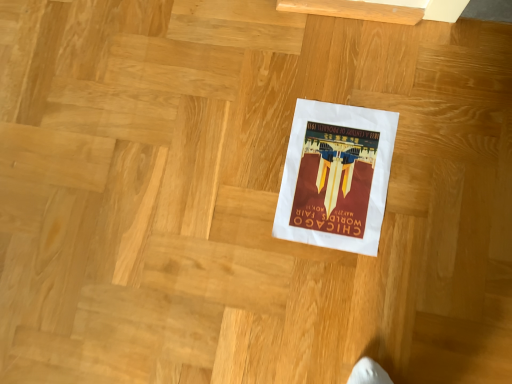
Question: Choose the correct answer: Is white paper at center inside white paper poster at center or outside it?

Choices:
 (A) inside
 (B) outside

Answer: (B)

Question: Based on their sizes in the image, would you say white paper at center is bigger or smaller than white paper poster at center?

Choices:
 (A) small
 (B) big

Answer: (B)

Question: Is point [245, 21] positioned closer to the camera than point [345, 137]?

Choices:
 (A) farther
 (B) closer

Answer: (A)

Question: Considering the positions of white paper poster at center and white paper at center in the image, is white paper poster at center wider or thinner than white paper at center?

Choices:
 (A) thin
 (B) wide

Answer: (A)

Question: Considering their positions, is white paper poster at center located in front of or behind white paper at center?

Choices:
 (A) behind
 (B) front

Answer: (A)

Question: Does point (344, 134) appear closer or farther from the camera than point (119, 86)?

Choices:
 (A) farther
 (B) closer

Answer: (B)

Question: Would you say white paper poster at center is to the left or to the right of white paper at center in the picture?

Choices:
 (A) left
 (B) right

Answer: (B)